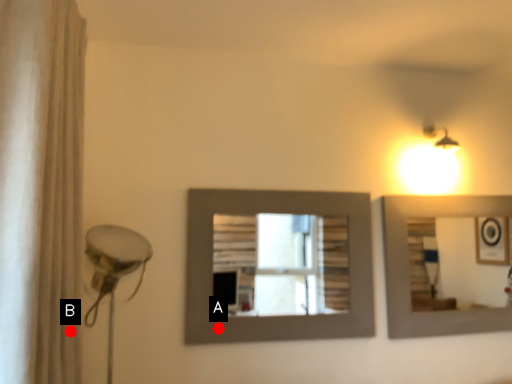
Question: Two points are circled on the image, labeled by A and B beside each circle. Which point is further to the camera?

Choices:
 (A) A is further
 (B) B is further

Answer: (A)